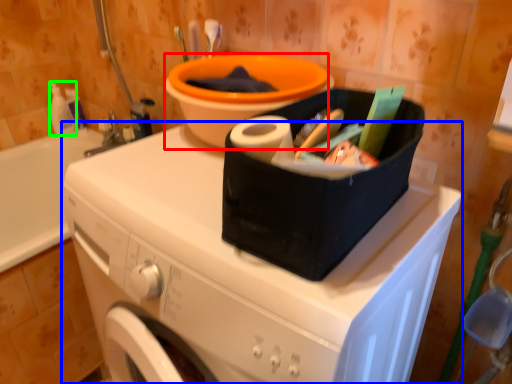
Question: Which object is positioned closest to basin (highlighted by a red box)? Select from washing machine (highlighted by a blue box) and cleaning product (highlighted by a green box).

Choices:
 (A) washing machine
 (B) cleaning product

Answer: (A)